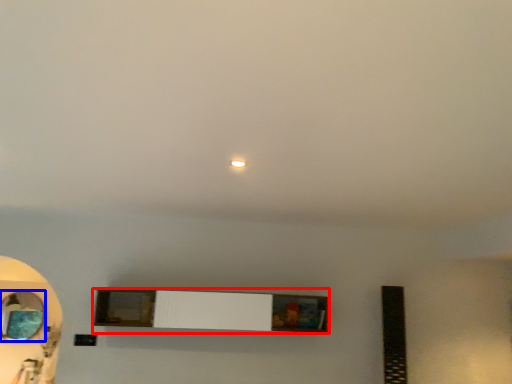
Question: Which of the following is the closest to the observer, shelf (highlighted by a red box) or mirror (highlighted by a blue box)?

Choices:
 (A) shelf
 (B) mirror

Answer: (A)